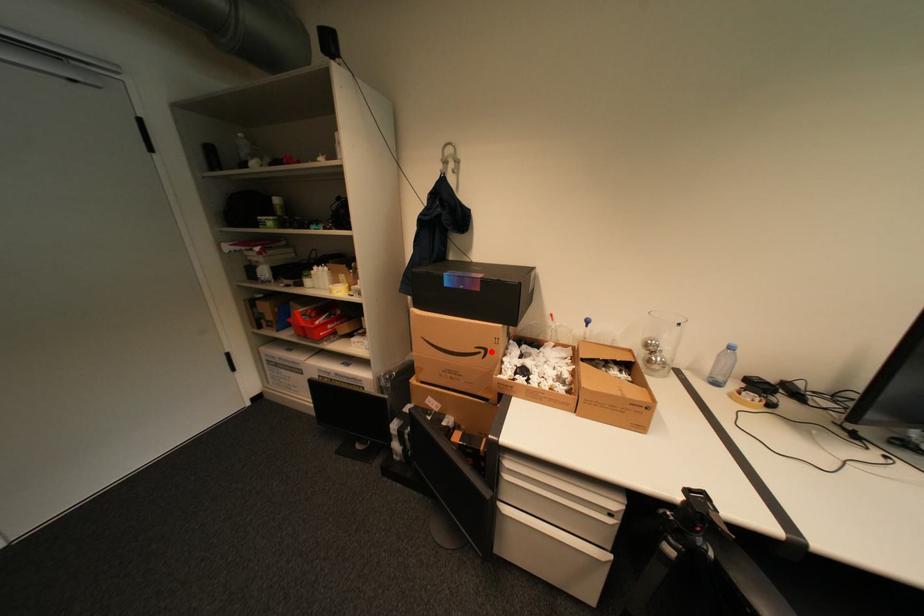
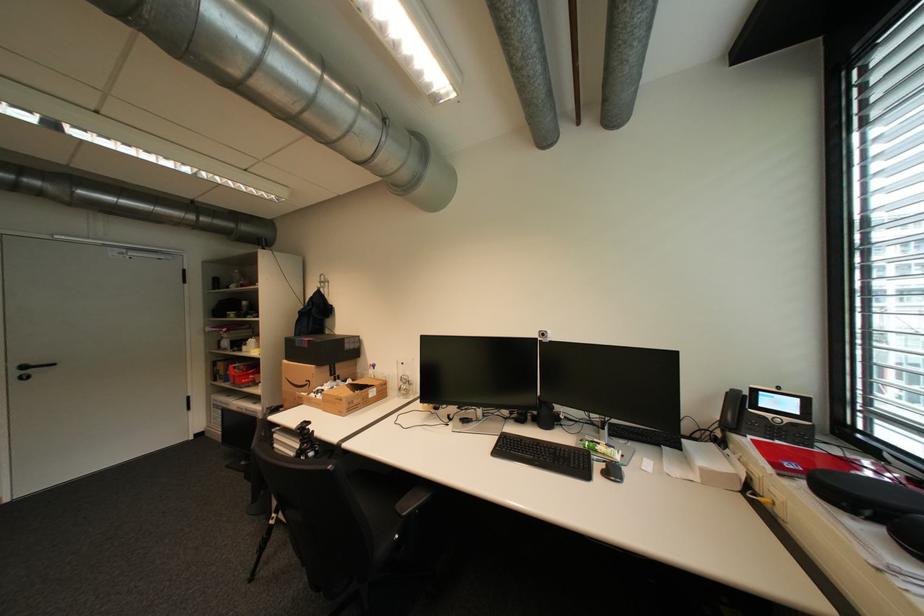
Question: I am providing you with two images of the same scene from different viewpoints. A red point is marked on the first image. Is the red point's position out of view in image 2?

Choices:
 (A) Yes
 (B) No

Answer: (B)